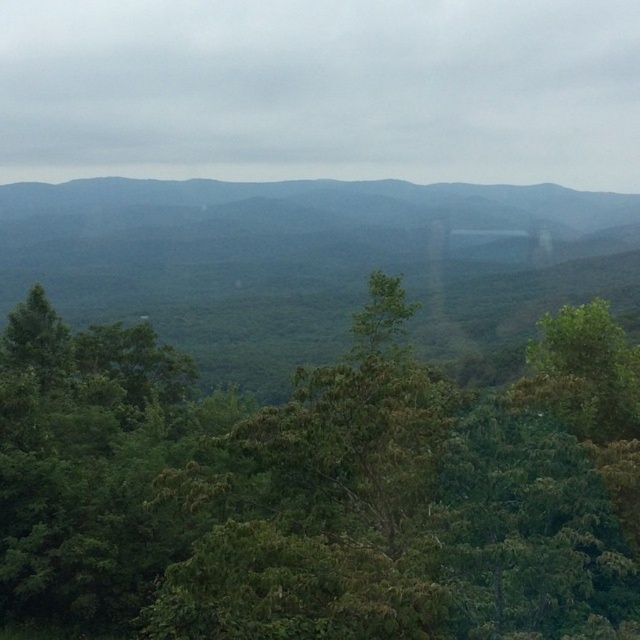
You are standing in the lush landscape and want to place a small flag at both point (413, 500) and point (380, 227). Which point will have its flag closer to your eyes?

Point (413, 500) is closer to the camera than point (380, 227), so the flag placed at point (413, 500) will be closer to your eyes.

You are an environmental scientist studying the landscape. You observe the green leafy tree at center and the green leafy forest at center. Which one appears closer to you in the image?

The green leafy tree at center appears closer because it is smaller than the green leafy forest at center, which is further away and thus appears larger in the image.